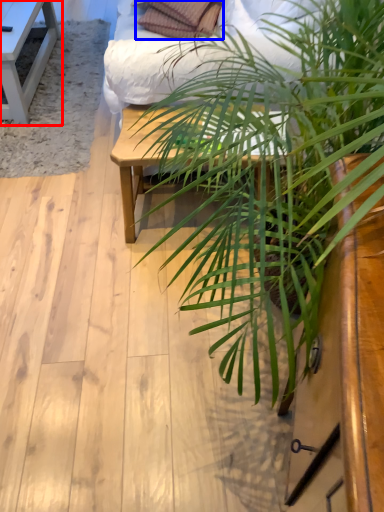
Question: Among these objects, which one is nearest to the camera, table (highlighted by a red box) or pillow (highlighted by a blue box)?

Choices:
 (A) table
 (B) pillow

Answer: (B)